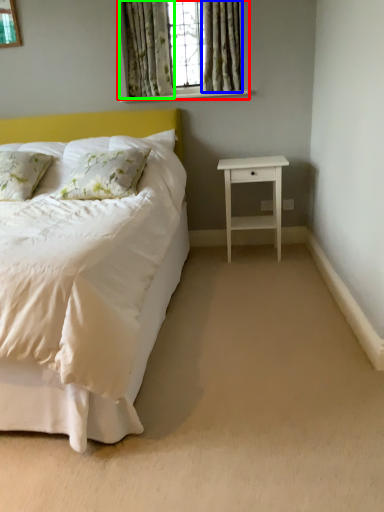
Question: Estimate the real-world distances between objects in this image. Which object is farther from window (highlighted by a red box), curtain (highlighted by a blue box) or curtain (highlighted by a green box)?

Choices:
 (A) curtain
 (B) curtain

Answer: (A)